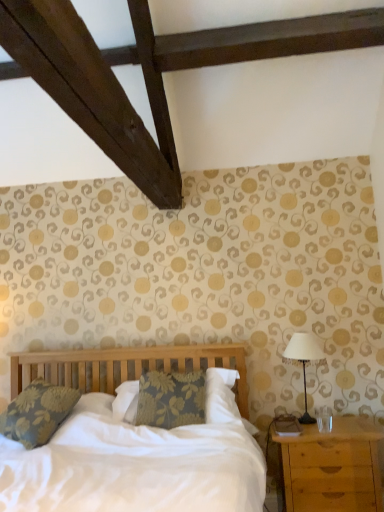
Question: Could you tell me if metallic silver table lamp at right is turned towards floral fabric pillow at left?

Choices:
 (A) yes
 (B) no

Answer: (B)

Question: Considering the relative positions of metallic silver table lamp at right and floral fabric pillow at left in the image provided, is metallic silver table lamp at right to the left of floral fabric pillow at left from the viewer's perspective?

Choices:
 (A) yes
 (B) no

Answer: (B)

Question: Would you say metallic silver table lamp at right is a long distance from floral fabric pillow at left?

Choices:
 (A) no
 (B) yes

Answer: (B)

Question: Is metallic silver table lamp at right oriented away from floral fabric pillow at left?

Choices:
 (A) no
 (B) yes

Answer: (A)

Question: Is metallic silver table lamp at right in front of floral fabric pillow at left?

Choices:
 (A) no
 (B) yes

Answer: (A)

Question: Is metallic silver table lamp at right thinner than floral fabric pillow at left?

Choices:
 (A) no
 (B) yes

Answer: (B)

Question: From a real-world perspective, is metallic silver table lamp at right on light brown wooden nightstand at lower right?

Choices:
 (A) no
 (B) yes

Answer: (B)

Question: Does metallic silver table lamp at right lie in front of light brown wooden nightstand at lower right?

Choices:
 (A) yes
 (B) no

Answer: (B)

Question: Can you confirm if metallic silver table lamp at right is wider than light brown wooden nightstand at lower right?

Choices:
 (A) yes
 (B) no

Answer: (B)

Question: Is metallic silver table lamp at right further to camera compared to light brown wooden nightstand at lower right?

Choices:
 (A) yes
 (B) no

Answer: (A)

Question: From the image's perspective, is metallic silver table lamp at right located beneath light brown wooden nightstand at lower right?

Choices:
 (A) no
 (B) yes

Answer: (A)

Question: Is metallic silver table lamp at right facing away from light brown wooden nightstand at lower right?

Choices:
 (A) yes
 (B) no

Answer: (B)

Question: Considering the relative sizes of floral fabric pillow at left and light brown wooden nightstand at lower right in the image provided, is floral fabric pillow at left taller than light brown wooden nightstand at lower right?

Choices:
 (A) yes
 (B) no

Answer: (B)